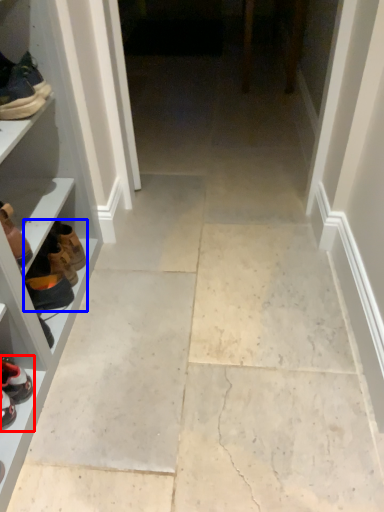
Question: Which object is closer to the camera taking this photo, footwear (highlighted by a red box) or shoe (highlighted by a blue box)?

Choices:
 (A) footwear
 (B) shoe

Answer: (A)